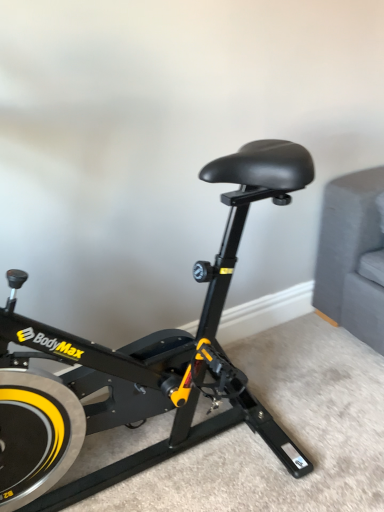
Where is `black matte stationary bicycle at center`? The width and height of the screenshot is (384, 512). black matte stationary bicycle at center is located at coordinates (138, 365).

What do you see at coordinates (138, 365) in the screenshot? This screenshot has height=512, width=384. I see `black matte stationary bicycle at center` at bounding box center [138, 365].

Identify the location of black matte stationary bicycle at center. (138, 365).